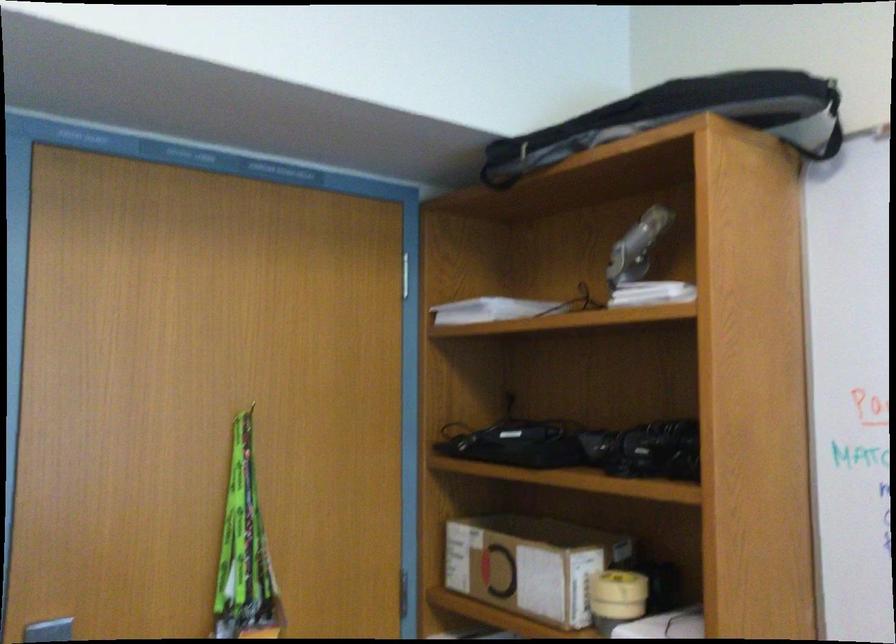
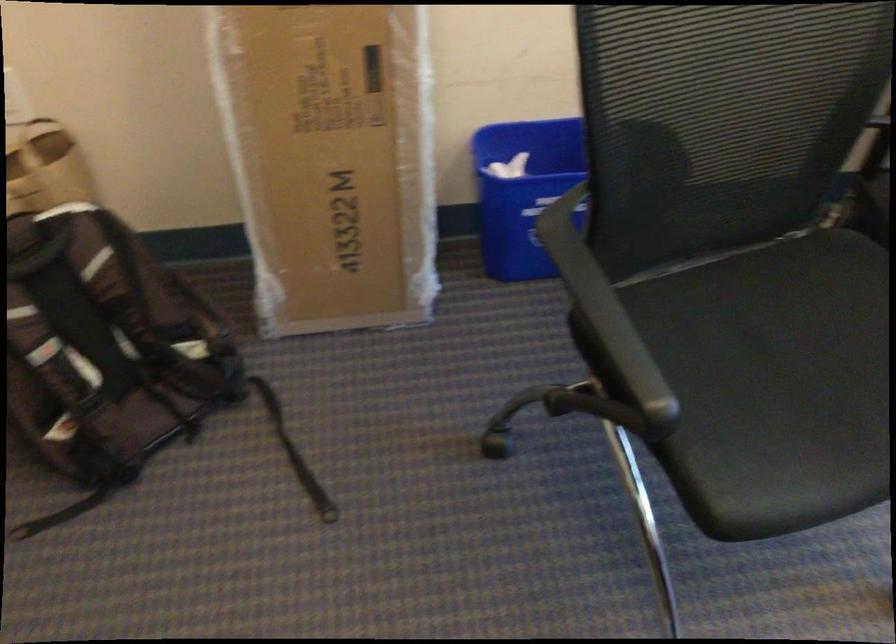
The images are taken continuously from a first-person perspective. In which direction is your viewpoint rotating?

The camera rotated toward right-down.